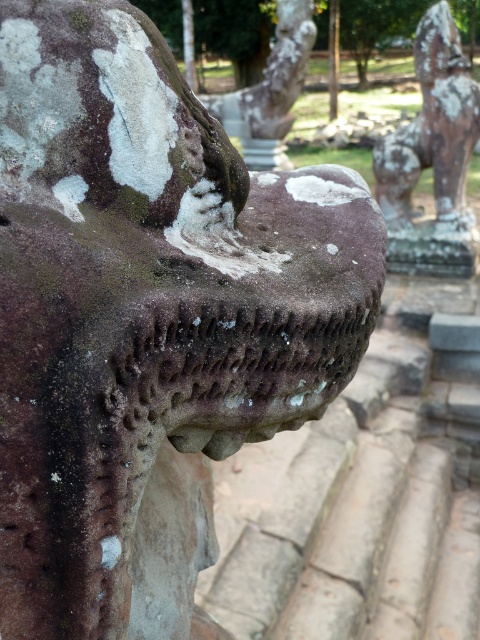
You are an archaeologist examining the stone sculpture. You notice two points marked on the sculpture at coordinates point [411,186] and point [271,115]. Which point is nearer to your eyes?

Point [411,186] is closer to the viewer than point [271,115].

You are an art conservator assessing the stone sculptures in the image. You need to determine which object requires immediate attention based on their height. The rusty stone lion at upper right and the rusty stone statue at center are both showing signs of erosion. Which one is taller and thus might need more urgent care?

The rusty stone lion at upper right is much taller than the rusty stone statue at center, so it might need more urgent care due to its greater height.